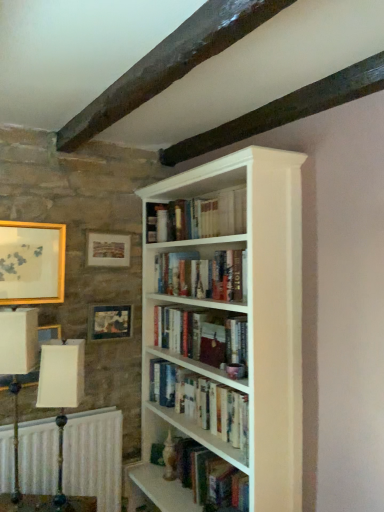
This screenshot has width=384, height=512. What are the coordinates of `white textured radiator at lower left` in the screenshot? It's located at (94, 457).

Find the location of a particular element. matte gold picture frame at upper left, placed as the second picture frame when sorted from left to right is located at coordinates (108, 250).

Describe the element at coordinates (169, 63) in the screenshot. I see `dark wood beam at upper center` at that location.

Locate an element on the screen. matte wooden picture frame at upper left, which is the 1th picture frame from right to left is located at coordinates (109, 322).

What is the approximate width of hardcover books at center, acting as the first book starting from the top?

hardcover books at center, acting as the first book starting from the top, is 8.12 inches wide.

What is the approximate height of hardcover books at center, acting as the first book starting from the top?

hardcover books at center, acting as the first book starting from the top, is 10.05 inches in height.

Locate an element on the screen. white textured radiator at lower left is located at coordinates (94, 457).

Considering the sizes of objects matte wooden picture frame at upper left, which is the 1th picture frame from right to left, and dark wood beam at upper center in the image provided, who is wider, matte wooden picture frame at upper left, which is the 1th picture frame from right to left, or dark wood beam at upper center?

Wider between the two is dark wood beam at upper center.

From the image's perspective, is matte wooden picture frame at upper left, the third picture frame positioned from the left, under dark wood beam at upper center?

Yes, from the image's perspective, matte wooden picture frame at upper left, the third picture frame positioned from the left, is beneath dark wood beam at upper center.

Which object is closer to the camera taking this photo, matte wooden picture frame at upper left, which is the 1th picture frame from right to left, or dark wood beam at upper center?

dark wood beam at upper center is in front.

Which is in front, point (105, 331) or point (81, 141)?

The point (81, 141) is in front.

Considering the relative sizes of white fabric lampshade at left, which is counted as the 1th table lamp, starting from the left, and white painted wood bookcase at center in the image provided, is white fabric lampshade at left, which is counted as the 1th table lamp, starting from the left, bigger than white painted wood bookcase at center?

Actually, white fabric lampshade at left, which is counted as the 1th table lamp, starting from the left, might be smaller than white painted wood bookcase at center.

Is white fabric lampshade at left, positioned as the second table lamp in right-to-left order, oriented towards white painted wood bookcase at center?

No, white fabric lampshade at left, positioned as the second table lamp in right-to-left order, is not turned towards white painted wood bookcase at center.

Does point (11, 497) appear closer or farther from the camera than point (250, 170)?

Point (11, 497) is positioned farther from the camera compared to point (250, 170).

Does hardcover book at center, the 2th book positioned from the bottom, have a larger size compared to white fabric lampshade at left, the second table lamp in the left-to-right sequence?

Indeed, hardcover book at center, the 2th book positioned from the bottom, has a larger size compared to white fabric lampshade at left, the second table lamp in the left-to-right sequence.

From a real-world perspective, between hardcover book at center, which is the third book from top to bottom, and white fabric lampshade at left, the second table lamp in the left-to-right sequence, who is vertically higher?

hardcover book at center, which is the third book from top to bottom.

Is hardcover book at center, which is the third book from top to bottom, located outside white fabric lampshade at left, the second table lamp in the left-to-right sequence?

Yes, hardcover book at center, which is the third book from top to bottom, is located beyond the bounds of white fabric lampshade at left, the second table lamp in the left-to-right sequence.

Could you measure the distance between hardcover book at center, which is the third book from top to bottom, and matte gold picture frame at upper left, placed as the second picture frame when sorted from left to right?

hardcover book at center, which is the third book from top to bottom, is 23.71 inches from matte gold picture frame at upper left, placed as the second picture frame when sorted from left to right.

What's the angular difference between hardcover book at center, the 2th book positioned from the bottom, and matte gold picture frame at upper left, placed as the second picture frame when sorted from left to right,'s facing directions?

91.4 degrees separate the facing orientations of hardcover book at center, the 2th book positioned from the bottom, and matte gold picture frame at upper left, placed as the second picture frame when sorted from left to right.

Would you say hardcover book at center, which is the third book from top to bottom, is to the left or to the right of matte gold picture frame at upper left, positioned as the second picture frame in right-to-left order, in the picture?

Clearly, hardcover book at center, which is the third book from top to bottom, is on the right of matte gold picture frame at upper left, positioned as the second picture frame in right-to-left order, in the image.

Is point (194, 350) positioned behind point (116, 266)?

No, it is in front of (116, 266).

Considering the positions of point (9, 475) and point (203, 442), is point (9, 475) closer or farther from the camera than point (203, 442)?

Clearly, point (9, 475) is more distant from the camera than point (203, 442).

Do you think white textured radiator at lower left is within white wood bookshelf at center, or outside of it?

white textured radiator at lower left is located beyond the bounds of white wood bookshelf at center.

Is matte gold picture frame at upper left, positioned as the second picture frame in right-to-left order, positioned behind hardcover books at center, acting as the first book starting from the top?

Yes, it is behind hardcover books at center, acting as the first book starting from the top.

Is hardcover books at center, marked as the fourth book in a bottom-to-top arrangement, completely or partially inside matte gold picture frame at upper left, placed as the second picture frame when sorted from left to right?

No, matte gold picture frame at upper left, placed as the second picture frame when sorted from left to right, does not contain hardcover books at center, marked as the fourth book in a bottom-to-top arrangement.

From a real-world perspective, who is located higher, matte gold picture frame at upper left, positioned as the second picture frame in right-to-left order, or hardcover books at center, marked as the fourth book in a bottom-to-top arrangement?

In real-world perspective, hardcover books at center, marked as the fourth book in a bottom-to-top arrangement, is above.

From the picture: Can you confirm if hardcover books at center, placed as the second book when sorted from top to bottom, is bigger than white fabric lampshade at left, which is counted as the 1th table lamp, starting from the left?

Indeed, hardcover books at center, placed as the second book when sorted from top to bottom, has a larger size compared to white fabric lampshade at left, which is counted as the 1th table lamp, starting from the left.

Starting from the white fabric lampshade at left, which is counted as the 1th table lamp, starting from the left, which book is the 2nd one behind? Please provide its 2D coordinates.

[(202, 275)]

In the scene shown: Is hardcover books at center, placed as the second book when sorted from top to bottom, positioned beyond the bounds of white fabric lampshade at left, positioned as the second table lamp in right-to-left order?

Yes.

Based on the photo, is hardcover books at center, which ranks as the third book in bottom-to-top order, looking in the opposite direction of white fabric lampshade at left, which is counted as the 1th table lamp, starting from the left?

No, white fabric lampshade at left, which is counted as the 1th table lamp, starting from the left, is not at the back of hardcover books at center, which ranks as the third book in bottom-to-top order.

Locate an element on the screen. beam in front of the matte wooden picture frame at upper left, the third picture frame positioned from the left is located at coordinates (169, 63).

You are a GUI agent. You are given a task and a screenshot of the screen. Output one action in this format:
    pyautogui.click(x=<x>, y=<y>)
    Task: Click on the bookcase above the white fabric lampshade at left, which is counted as the 1th table lamp, starting from the left (from the image's perspective)
    
    Given the screenshot: What is the action you would take?
    pyautogui.click(x=225, y=331)

Based on their spatial positions, is white wood bookshelf at center or hardcover books at center, placed as the second book when sorted from top to bottom, further from matte gold picture frame at upper left, positioned as the second picture frame in right-to-left order?

white wood bookshelf at center is positioned further to the anchor matte gold picture frame at upper left, positioned as the second picture frame in right-to-left order.

When comparing their distances from hardcover books at center, placed as the second book when sorted from top to bottom, does matte gold picture frame at upper left, placed as the second picture frame when sorted from left to right, or white fabric lampshade at left, positioned as the second table lamp in right-to-left order, seem further?

The object further to hardcover books at center, placed as the second book when sorted from top to bottom, is white fabric lampshade at left, positioned as the second table lamp in right-to-left order.

Considering their positions, is hardcover book at center, which is the third book from top to bottom, positioned further to matte wooden picture frame at upper left, which is the 1th picture frame from right to left, than wooden picture frame at left, the first picture frame in the left-to-right sequence?

The object further to matte wooden picture frame at upper left, which is the 1th picture frame from right to left, is hardcover book at center, which is the third book from top to bottom.

Considering their positions, is matte wooden picture frame at upper left, which is the 1th picture frame from right to left, positioned closer to white textured radiator at lower left than hardcover books at center, marked as the fourth book in a top-to-bottom arrangement?

Based on the image, hardcover books at center, marked as the fourth book in a top-to-bottom arrangement, appears to be nearer to white textured radiator at lower left.

Based on the photo, based on their spatial positions, is dark wood beam at upper center or white wood bookshelf at center further from matte gold picture frame at upper left, positioned as the second picture frame in right-to-left order?

white wood bookshelf at center lies further to matte gold picture frame at upper left, positioned as the second picture frame in right-to-left order, than the other object.

Considering their positions, is hardcover books at center, marked as the fourth book in a top-to-bottom arrangement, positioned further to white textured radiator at lower left than white wood bookshelf at center?

hardcover books at center, marked as the fourth book in a top-to-bottom arrangement, is positioned further to the anchor white textured radiator at lower left.

From the image, which object appears to be farther from hardcover books at center, placed as the second book when sorted from top to bottom, hardcover book at center, the 2th book positioned from the bottom, or white painted wood bookcase at center?

white painted wood bookcase at center lies further to hardcover books at center, placed as the second book when sorted from top to bottom, than the other object.

When comparing their distances from hardcover books at center, marked as the fourth book in a bottom-to-top arrangement, does white painted wood bookcase at center or matte gold picture frame at upper left, positioned as the second picture frame in right-to-left order, seem closer?

Among the two, matte gold picture frame at upper left, positioned as the second picture frame in right-to-left order, is located nearer to hardcover books at center, marked as the fourth book in a bottom-to-top arrangement.

Locate an element on the screen. The height and width of the screenshot is (512, 384). book between white fabric lampshade at left, which is counted as the 1th table lamp, starting from the left, and white painted wood bookcase at center from left to right is located at coordinates (203, 335).

Locate an element on the screen. book between hardcover books at center, which ranks as the third book in bottom-to-top order, and matte wooden picture frame at upper left, the third picture frame positioned from the left, in the front-back direction is located at coordinates (203, 335).

At what (x,y) coordinates should I click in order to perform the action: click on bookcase between hardcover books at center, marked as the fourth book in a bottom-to-top arrangement, and white fabric lampshade at left, which is counted as the 1th table lamp, starting from the left, from top to bottom. Please return your answer as a coordinate pair (x, y). The width and height of the screenshot is (384, 512). Looking at the image, I should click on (225, 331).

The height and width of the screenshot is (512, 384). I want to click on bookcase located between wooden picture frame at left, the first picture frame in the left-to-right sequence, and white wood bookshelf at center in the left-right direction, so click(225, 331).